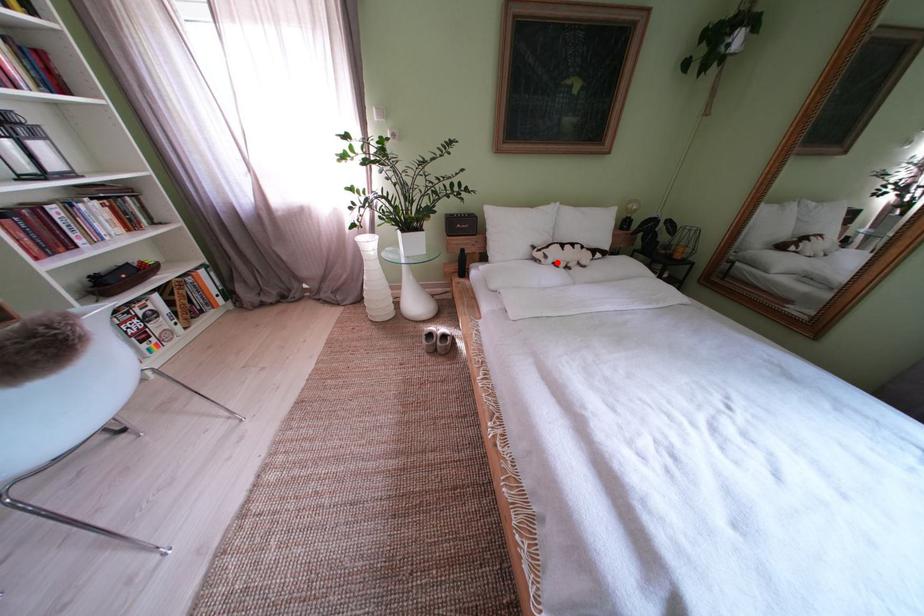
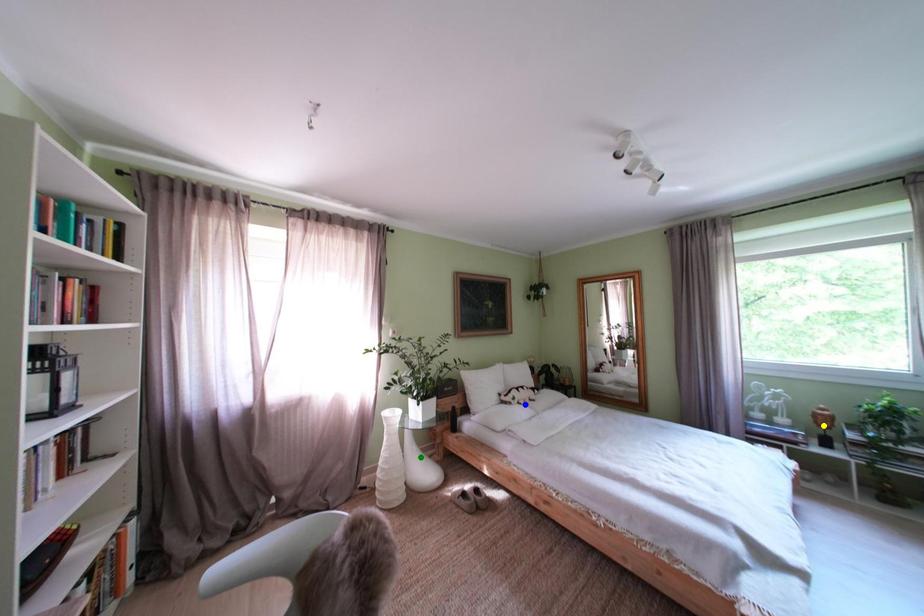
Question: I am providing you with two images of the same scene from different viewpoints. A red point is marked on the first image. You are given multiple points on the second image. Which spot in image 2 lines up with the point in image 1?

Choices:
 (A) yellow point
 (B) blue point
 (C) green point

Answer: (B)